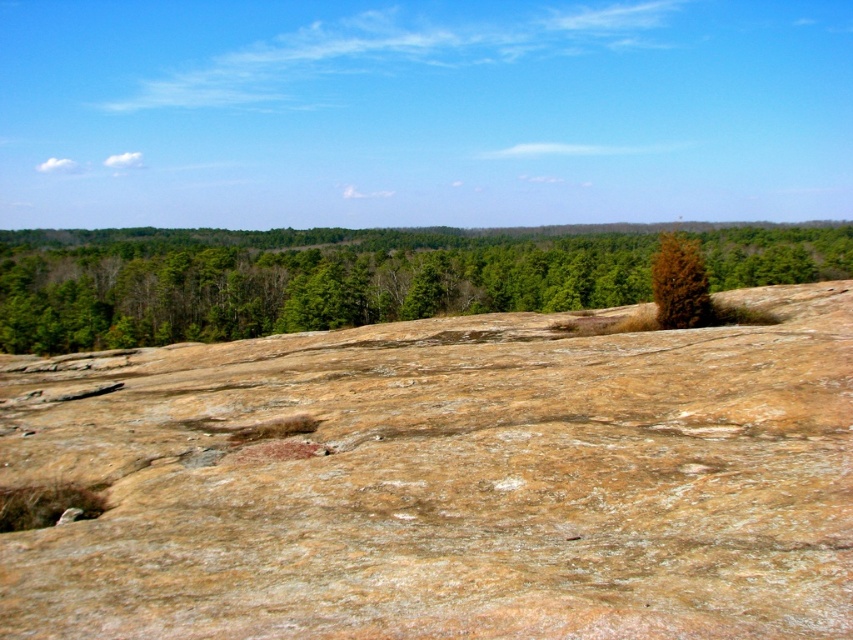
Question: Is brown rough rock at center behind green leafy tree at center?

Choices:
 (A) no
 (B) yes

Answer: (A)

Question: Which point appears farthest from the camera in this image?

Choices:
 (A) (666, 243)
 (B) (84, 605)
 (C) (299, 296)

Answer: (C)

Question: Can you confirm if green leafy tree at center is wider than brown textured tree at upper right?

Choices:
 (A) no
 (B) yes

Answer: (B)

Question: Which is farther from the green leafy tree at center?

Choices:
 (A) brown rough rock at center
 (B) brown textured tree at upper right

Answer: (B)

Question: Can you confirm if green leafy tree at center is positioned to the left of brown textured tree at upper right?

Choices:
 (A) yes
 (B) no

Answer: (B)

Question: Which object is closer to the camera taking this photo?

Choices:
 (A) brown rough rock at center
 (B) brown textured tree at upper right
 (C) green leafy tree at center

Answer: (A)